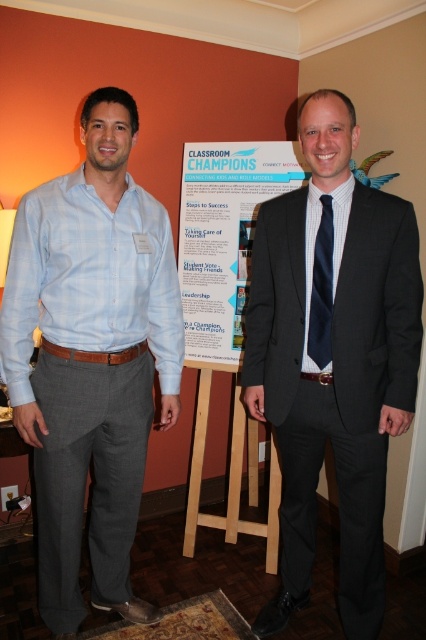
Is matte black suit at center positioned in front of white paper poster at center?

Yes.

Which is in front, point (414, 349) or point (210, 340)?

Point (414, 349) is in front.

You are a GUI agent. You are given a task and a screenshot of the screen. Output one action in this format:
    pyautogui.click(x=<x>, y=<y>)
    Task: Click on the matte black suit at center
    
    Given the screenshot: What is the action you would take?
    pyautogui.click(x=333, y=356)

Is light blue plaid shirt at center in front of white paper poster at center?

That is True.

Where is `light blue plaid shirt at center`? The image size is (426, 640). light blue plaid shirt at center is located at coordinates (92, 356).

Is light blue plaid shirt at center below navy blue silk tie at center?

Correct, light blue plaid shirt at center is located below navy blue silk tie at center.

Between light blue plaid shirt at center and navy blue silk tie at center, which one appears on the left side from the viewer's perspective?

From the viewer's perspective, light blue plaid shirt at center appears more on the left side.

Locate an element on the screen. light blue plaid shirt at center is located at coordinates (92, 356).

The image size is (426, 640). Identify the location of light blue plaid shirt at center. (92, 356).